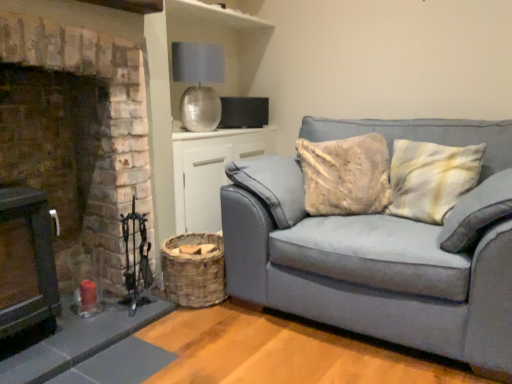
Question: Looking at their shapes, would you say woven wood basket at lower center is wider or thinner than woven brown basket at lower left?

Choices:
 (A) wide
 (B) thin

Answer: (B)

Question: Relative to woven brown basket at lower left, is woven wood basket at lower center in front or behind?

Choices:
 (A) behind
 (B) front

Answer: (A)

Question: Which object is positioned farthest from the metallic silver lampshade at upper center?

Choices:
 (A) woven brown basket at lower left
 (B) brick fireplace at left
 (C) suede gray couch at right
 (D) woven wood basket at lower center

Answer: (C)

Question: Which is farther from the brick fireplace at left?

Choices:
 (A) suede gray couch at right
 (B) metallic silver lampshade at upper center
 (C) woven brown basket at lower left
 (D) woven wood basket at lower center

Answer: (A)